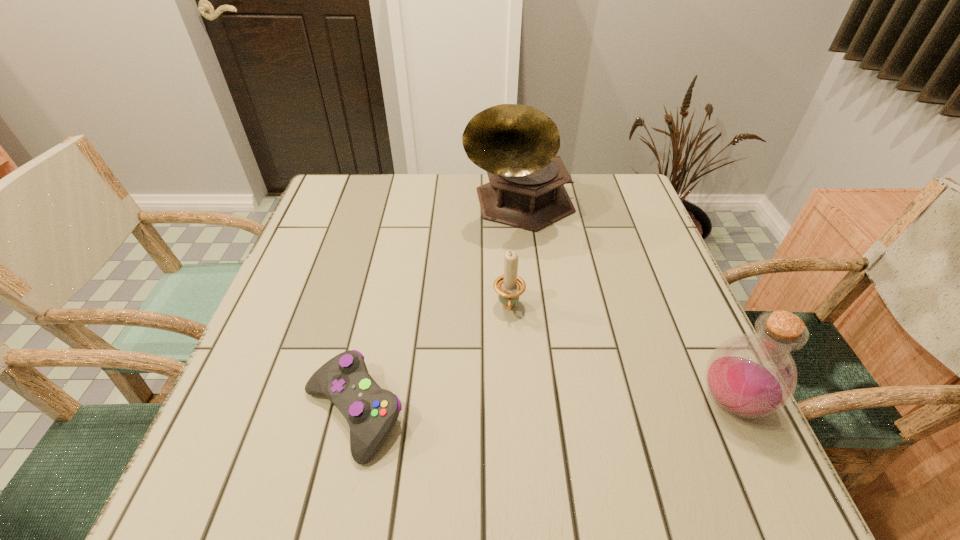
In the image, there is a desktop. In order to click on free space at the near right corner in this screenshot , I will do `click(744, 430)`.

This screenshot has width=960, height=540. Identify the location of vacant space that is in between the control and the phonograph record. (437, 309).

At what (x,y) coordinates should I click in order to perform the action: click on empty space that is in between the bottle and the tallest object. Please return your answer as a coordinate pair (x, y). This screenshot has width=960, height=540. Looking at the image, I should click on (625, 303).

In order to click on vacant region between the farthest object and the shortest object in this screenshot , I will do `click(437, 309)`.

You are a GUI agent. You are given a task and a screenshot of the screen. Output one action in this format:
    pyautogui.click(x=<x>, y=<y>)
    Task: Click on the free space between the rightmost object and the tallest object
    The width and height of the screenshot is (960, 540).
    Given the screenshot: What is the action you would take?
    pyautogui.click(x=625, y=303)

You are a GUI agent. You are given a task and a screenshot of the screen. Output one action in this format:
    pyautogui.click(x=<x>, y=<y>)
    Task: Click on the vacant area that lies between the phonograph record and the third shortest object
    The image size is (960, 540).
    Given the screenshot: What is the action you would take?
    pyautogui.click(x=625, y=303)

At what (x,y) coordinates should I click in order to perform the action: click on blank region between the candle_holder and the bottle. Please return your answer as a coordinate pair (x, y). Looking at the image, I should click on (619, 355).

Where is `the third closest object to the second farthest object`? This screenshot has width=960, height=540. the third closest object to the second farthest object is located at coordinates (753, 375).

What are the coordinates of `object that ranks as the second closest to the third tallest object` in the screenshot? It's located at (371, 412).

Where is `free point that satisfies the following two spatial constraints: 1. on the back side of the leftmost object; 2. on the left side of the third nearest object`? free point that satisfies the following two spatial constraints: 1. on the back side of the leftmost object; 2. on the left side of the third nearest object is located at coordinates (377, 308).